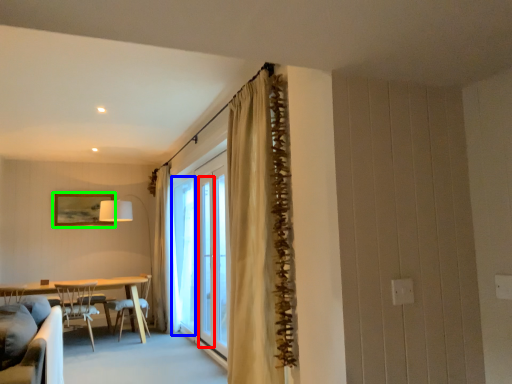
Question: Considering the real-world distances, which object is farthest from screen door (highlighted by a red box)? window (highlighted by a blue box) or picture frame (highlighted by a green box)?

Choices:
 (A) window
 (B) picture frame

Answer: (B)